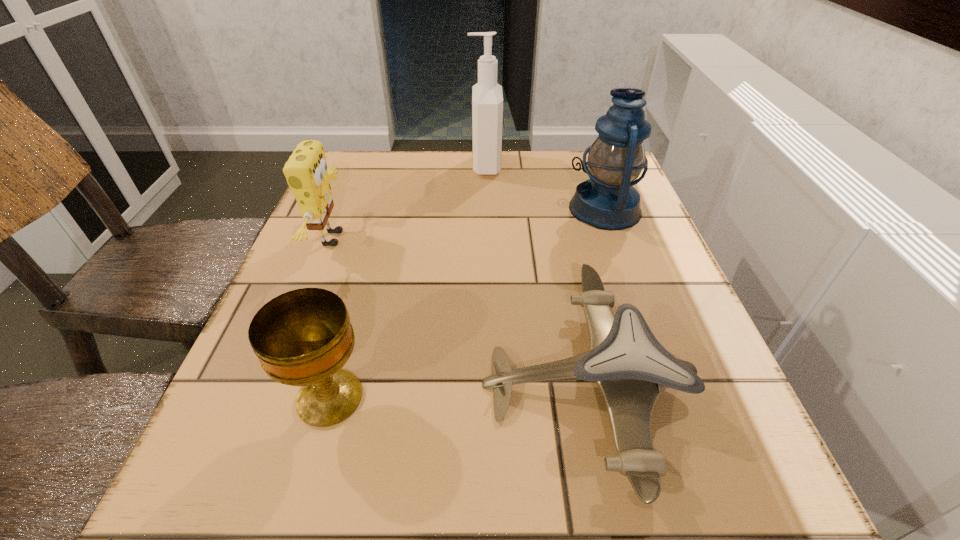
Identify the location of free spot between the shortest object and the sponge. The image size is (960, 540). (460, 312).

Image resolution: width=960 pixels, height=540 pixels. I want to click on object that is the third closest to the fourth shortest object, so click(306, 171).

Identify the location of object that stands as the second closest to the lantern. The height and width of the screenshot is (540, 960). (631, 368).

This screenshot has height=540, width=960. Find the location of `vacant point that satisfies the following two spatial constraints: 1. on the back side of the chalice; 2. on the face of the sponge`. vacant point that satisfies the following two spatial constraints: 1. on the back side of the chalice; 2. on the face of the sponge is located at coordinates (374, 239).

Locate an element on the screen. The height and width of the screenshot is (540, 960). free point that satisfies the following two spatial constraints: 1. on the face of the sponge; 2. on the back side of the chalice is located at coordinates (273, 398).

Identify the location of vacant space that satisfies the following two spatial constraints: 1. on the face of the sponge; 2. on the left side of the chalice. (273, 398).

Identify the location of free space that satisfies the following two spatial constraints: 1. on the face of the fourth tallest object; 2. on the left side of the sponge. This screenshot has height=540, width=960. (273, 398).

Locate an element on the screen. vacant space that satisfies the following two spatial constraints: 1. on the face of the sponge; 2. on the left side of the chalice is located at coordinates (273, 398).

Where is `vacant region that satisfies the following two spatial constraints: 1. on the face of the sponge; 2. on the right side of the chalice`? The width and height of the screenshot is (960, 540). vacant region that satisfies the following two spatial constraints: 1. on the face of the sponge; 2. on the right side of the chalice is located at coordinates (273, 398).